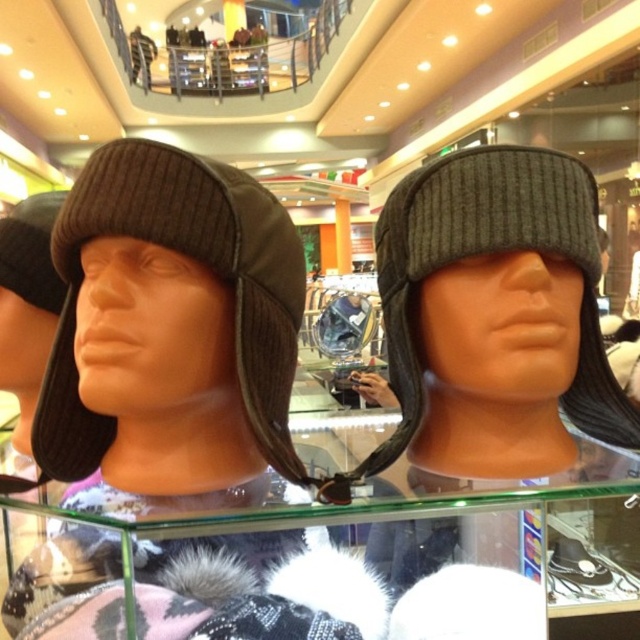
Does dark brown knit hat at left appear under dark gray ribbed knit hat at center?

Yes.

Is the position of dark brown knit hat at left less distant than that of dark gray ribbed knit hat at center?

That is True.

Image resolution: width=640 pixels, height=640 pixels. What are the coordinates of `dark brown knit hat at left` in the screenshot? It's located at (189, 257).

This screenshot has width=640, height=640. What are the coordinates of `dark brown knit hat at left` in the screenshot? It's located at (189, 257).